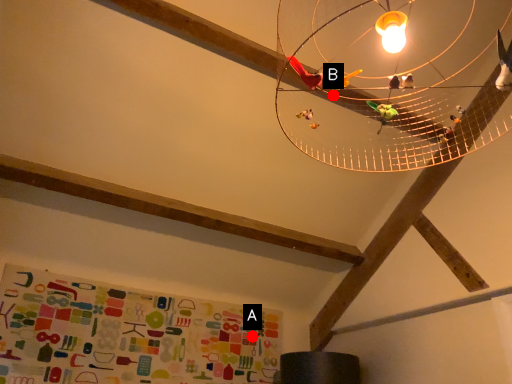
Question: Two points are circled on the image, labeled by A and B beside each circle. Among these points, which one is nearest to the camera?

Choices:
 (A) A is closer
 (B) B is closer

Answer: (B)